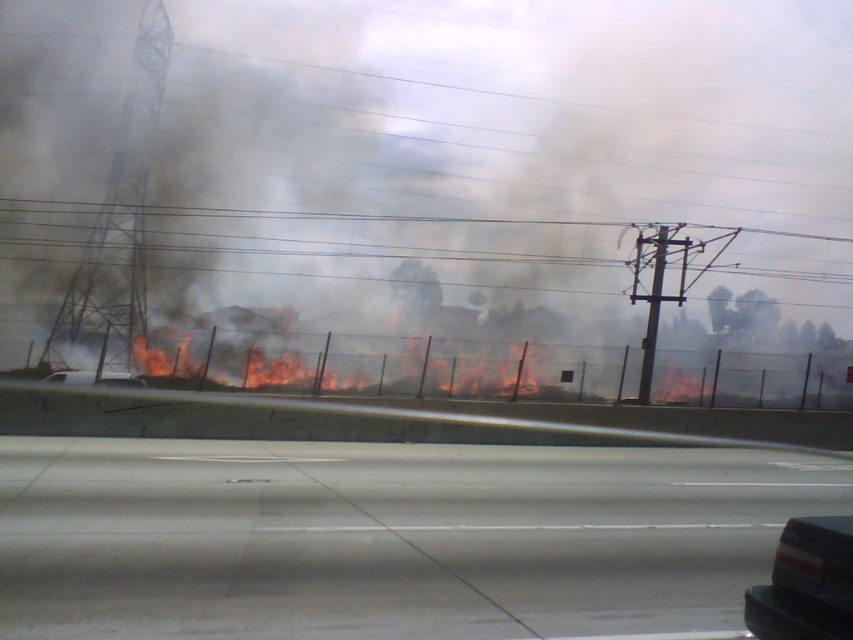
Question: Which is nearer to the black matte car at lower center?

Choices:
 (A) black glossy car at lower right
 (B) black smoke at center

Answer: (A)

Question: Considering the relative positions of black smoke at center and black glossy car at lower right in the image provided, where is black smoke at center located with respect to black glossy car at lower right?

Choices:
 (A) below
 (B) above

Answer: (B)

Question: Among these points, which one is nearest to the camera?

Choices:
 (A) (799, 564)
 (B) (332, 54)
 (C) (136, 385)

Answer: (A)

Question: Is black glossy car at lower right further to camera compared to black matte car at lower center?

Choices:
 (A) yes
 (B) no

Answer: (B)

Question: Which point is farther to the camera?

Choices:
 (A) black smoke at center
 (B) black glossy car at lower right

Answer: (A)

Question: Can you confirm if black smoke at center is positioned below black glossy car at lower right?

Choices:
 (A) no
 (B) yes

Answer: (A)